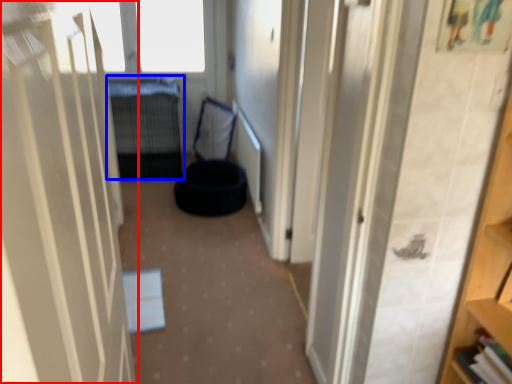
Question: Which of the following is the closest to the observer, door (highlighted by a red box) or bed (highlighted by a blue box)?

Choices:
 (A) door
 (B) bed

Answer: (A)